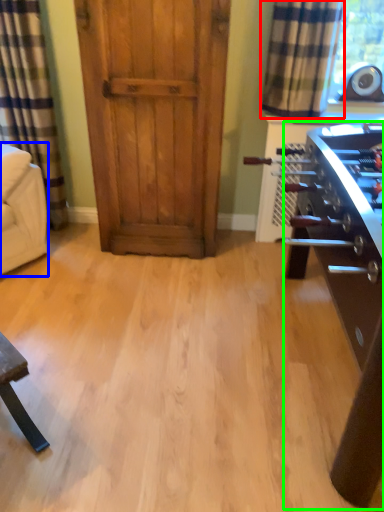
Question: Which is farther away from curtain (highlighted by a red box)? armchair (highlighted by a blue box) or table (highlighted by a green box)?

Choices:
 (A) armchair
 (B) table

Answer: (A)